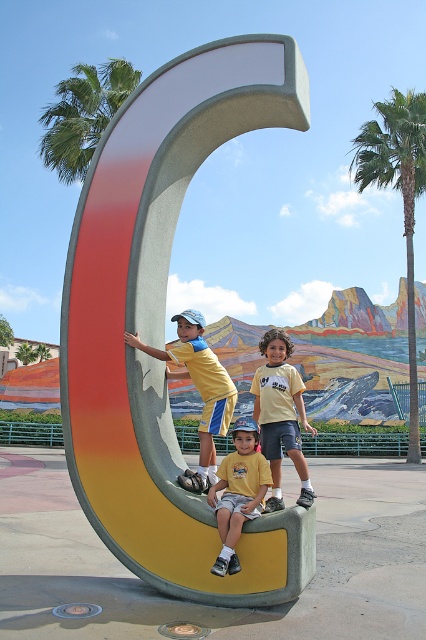
Question: Which point is farther to the camera?

Choices:
 (A) yellow cotton shirt at center
 (B) yellow matte shirt at center
 (C) green leafy palm tree at upper left

Answer: (C)

Question: Is green leafy palm tree at upper left bigger than yellow matte shirt at center?

Choices:
 (A) yes
 (B) no

Answer: (A)

Question: Is green leafy palm tree at upper right in front of yellow matte shirt at center?

Choices:
 (A) yes
 (B) no

Answer: (B)

Question: Is yellow matte shorts at center to the left of yellow matte shirt at center from the viewer's perspective?

Choices:
 (A) no
 (B) yes

Answer: (B)

Question: Which point is closer to the camera taking this photo?

Choices:
 (A) (204, 387)
 (B) (304, 484)

Answer: (B)

Question: Which point appears farthest from the camera in this image?

Choices:
 (A) (155, 422)
 (B) (409, 417)
 (C) (207, 387)

Answer: (B)